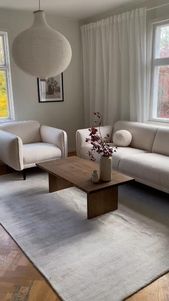
What are the coordinates of `ceiling` in the screenshot? It's located at (77, 6).